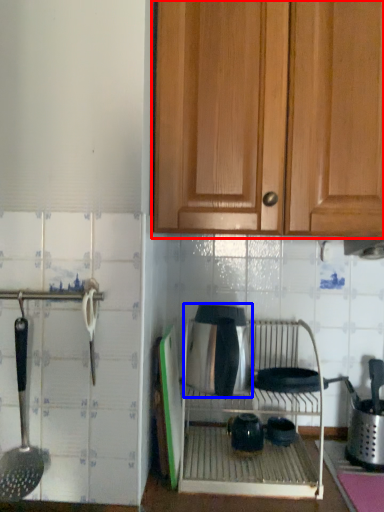
Question: Among these objects, which one is farthest to the camera, cabinetry (highlighted by a red box) or appliance (highlighted by a blue box)?

Choices:
 (A) cabinetry
 (B) appliance

Answer: (B)